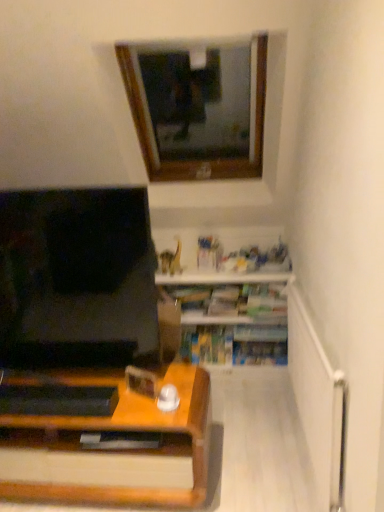
Question: Is white glossy shelf at lower center directly adjacent to wooden frame at upper center?

Choices:
 (A) no
 (B) yes

Answer: (A)

Question: Is white glossy shelf at lower center to the left of wooden frame at upper center from the viewer's perspective?

Choices:
 (A) yes
 (B) no

Answer: (B)

Question: Is white glossy shelf at lower center at the right side of wooden frame at upper center?

Choices:
 (A) no
 (B) yes

Answer: (B)

Question: From a real-world perspective, does white glossy shelf at lower center stand above wooden frame at upper center?

Choices:
 (A) no
 (B) yes

Answer: (A)

Question: Does white glossy shelf at lower center have a larger size compared to wooden frame at upper center?

Choices:
 (A) yes
 (B) no

Answer: (B)

Question: Is white glossy shelf at lower center wider than wooden frame at upper center?

Choices:
 (A) yes
 (B) no

Answer: (B)

Question: From a real-world perspective, is wooden frame at upper center beneath white glossy shelf at lower center?

Choices:
 (A) no
 (B) yes

Answer: (A)

Question: Does wooden frame at upper center lie behind white glossy shelf at lower center?

Choices:
 (A) no
 (B) yes

Answer: (A)

Question: Is wooden frame at upper center taller than white glossy shelf at lower center?

Choices:
 (A) no
 (B) yes

Answer: (B)

Question: Is wooden frame at upper center aimed at white glossy shelf at lower center?

Choices:
 (A) no
 (B) yes

Answer: (A)

Question: Is wooden frame at upper center at the left side of white glossy shelf at lower center?

Choices:
 (A) yes
 (B) no

Answer: (A)

Question: Is wooden frame at upper center smaller than white glossy shelf at lower center?

Choices:
 (A) no
 (B) yes

Answer: (A)

Question: From the image's perspective, is wooden frame at upper center above or below white glossy shelf at lower center?

Choices:
 (A) below
 (B) above

Answer: (B)